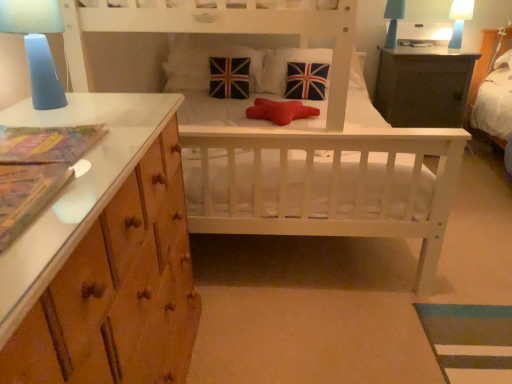
What do you see at coordinates (459, 20) in the screenshot?
I see `blue matte lampshade at upper right, positioned as the 1th bedside lamp in right-to-left order` at bounding box center [459, 20].

Identify the location of blue matte lampshade at upper right, the 2th bedside lamp from the bottom. This screenshot has height=384, width=512. (459, 20).

How much space does union jack fabric pillow at center, which appears as the 4th pillow when viewed from the left, occupy horizontally?

union jack fabric pillow at center, which appears as the 4th pillow when viewed from the left, is 18.10 inches wide.

The image size is (512, 384). What do you see at coordinates (291, 136) in the screenshot?
I see `white wooden crib at center` at bounding box center [291, 136].

This screenshot has width=512, height=384. What do you see at coordinates (229, 77) in the screenshot?
I see `velvet union jack pillow at center, which is the 2th pillow in left-to-right order` at bounding box center [229, 77].

Identify the location of blue frosted glass lamp at upper left, positioned as the first bedside lamp in bottom-to-top order. (37, 46).

Measure the distance between point (404, 11) and camera.

10.58 feet.

Where is `red felt pillow at center, the 2th pillow from the right`? The width and height of the screenshot is (512, 384). red felt pillow at center, the 2th pillow from the right is located at coordinates (280, 111).

This screenshot has height=384, width=512. What are the coordinates of `blue matte lampshade at upper right, which is the 2th bedside lamp in front-to-back order` in the screenshot? It's located at (459, 20).

Is point (461, 21) positioned behind point (23, 22)?

Yes, point (461, 21) is behind point (23, 22).

From a real-world perspective, which object rests below the other?

In real-world perspective, blue matte lampshade at upper right, positioned as the 3th bedside lamp in left-to-right order, is lower.

Considering the relative positions of blue matte lampshade at upper right, which is counted as the 2th bedside lamp, starting from the back, and blue frosted glass lamp at upper left, the third bedside lamp positioned from the top, in the image provided, is blue matte lampshade at upper right, which is counted as the 2th bedside lamp, starting from the back, to the right of blue frosted glass lamp at upper left, the third bedside lamp positioned from the top, from the viewer's perspective?

Correct, you'll find blue matte lampshade at upper right, which is counted as the 2th bedside lamp, starting from the back, to the right of blue frosted glass lamp at upper left, the third bedside lamp positioned from the top.

I want to click on the 2nd bedside lamp counting from the right side of the blue frosted glass lamp at upper left, positioned as the 1th bedside lamp in left-to-right order, so click(459, 20).

Between blue matte lampshade at upper right, the 3th bedside lamp viewed from the front, and dark gray wooden table at upper right, which one has larger size?

dark gray wooden table at upper right.

Based on the photo, how many degrees apart are the facing directions of blue matte lampshade at upper right, marked as the 2th bedside lamp in a right-to-left arrangement, and dark gray wooden table at upper right?

There is a 0.49-degree angle between the facing directions of blue matte lampshade at upper right, marked as the 2th bedside lamp in a right-to-left arrangement, and dark gray wooden table at upper right.

This screenshot has height=384, width=512. I want to click on table that appears in front of the blue matte lampshade at upper right, the 1th bedside lamp in the top-to-bottom sequence, so click(423, 86).

Do you think blue matte lampshade at upper right, the 3th bedside lamp viewed from the front, is within dark gray wooden table at upper right, or outside of it?

blue matte lampshade at upper right, the 3th bedside lamp viewed from the front, is not inside dark gray wooden table at upper right, it's outside.

Is dark gray wooden table at upper right facing away from blue matte lampshade at upper right, which is counted as the 2th bedside lamp, starting from the back?

No, dark gray wooden table at upper right is not facing the opposite direction of blue matte lampshade at upper right, which is counted as the 2th bedside lamp, starting from the back.

Is dark gray wooden table at upper right to the right of blue matte lampshade at upper right, positioned as the 3th bedside lamp in left-to-right order, from the viewer's perspective?

In fact, dark gray wooden table at upper right is to the left of blue matte lampshade at upper right, positioned as the 3th bedside lamp in left-to-right order.

From a real-world perspective, is dark gray wooden table at upper right positioned above or below blue matte lampshade at upper right, positioned as the 3th bedside lamp in left-to-right order?

From a real-world perspective, dark gray wooden table at upper right is physically below blue matte lampshade at upper right, positioned as the 3th bedside lamp in left-to-right order.

From the image's perspective, between dark gray wooden table at upper right and blue matte lampshade at upper right, which is the 2th bedside lamp in front-to-back order, who is located below?

From the image's view, dark gray wooden table at upper right is below.

Does blue matte lampshade at upper right, the 2th bedside lamp from the bottom, come in front of white wooden crib at center?

That is False.

Considering the positions of objects blue matte lampshade at upper right, positioned as the 1th bedside lamp in right-to-left order, and white wooden crib at center in the image provided, who is more to the left, blue matte lampshade at upper right, positioned as the 1th bedside lamp in right-to-left order, or white wooden crib at center?

white wooden crib at center.

Considering the sizes of objects dark gray wooden table at upper right and white wooden crib at center in the image provided, who is bigger, dark gray wooden table at upper right or white wooden crib at center?

white wooden crib at center is bigger.

Looking at their sizes, would you say dark gray wooden table at upper right is wider or thinner than white wooden crib at center?

In the image, dark gray wooden table at upper right appears to be more narrow than white wooden crib at center.

Can you tell me how much dark gray wooden table at upper right and white wooden crib at center differ in facing direction?

The angle between the facing direction of dark gray wooden table at upper right and the facing direction of white wooden crib at center is 1.55 degrees.

Where is `infant bed on the left of dark gray wooden table at upper right`? This screenshot has width=512, height=384. infant bed on the left of dark gray wooden table at upper right is located at coordinates (291, 136).

Who is taller, blue frosted glass lamp at upper left, the third bedside lamp positioned from the top, or velvet union jack pillow at center, which appears as the 1th pillow when viewed from the left?

With more height is velvet union jack pillow at center, which appears as the 1th pillow when viewed from the left.

Is velvet union jack pillow at center, which appears as the 1th pillow when viewed from the left, completely or partially inside blue frosted glass lamp at upper left, positioned as the 1th bedside lamp in left-to-right order?

No, blue frosted glass lamp at upper left, positioned as the 1th bedside lamp in left-to-right order, does not contain velvet union jack pillow at center, which appears as the 1th pillow when viewed from the left.

From a real-world perspective, is blue frosted glass lamp at upper left, positioned as the 1th bedside lamp in left-to-right order, under velvet union jack pillow at center, which appears as the 1th pillow when viewed from the left?

No, from a real-world perspective, blue frosted glass lamp at upper left, positioned as the 1th bedside lamp in left-to-right order, is not below velvet union jack pillow at center, which appears as the 1th pillow when viewed from the left.

Between blue frosted glass lamp at upper left, positioned as the 1th bedside lamp in left-to-right order, and velvet union jack pillow at center, which is counted as the fourth pillow, starting from the right, which one has larger size?

With larger size is velvet union jack pillow at center, which is counted as the fourth pillow, starting from the right.

Considering the positions of points (265, 56) and (451, 37), is point (265, 56) closer to camera compared to point (451, 37)?

Yes.

From the image's perspective, which one is positioned lower, union jack fabric pillow at center, which is the first pillow from right to left, or blue matte lampshade at upper right, the second bedside lamp when ordered from top to bottom?

From the image's view, union jack fabric pillow at center, which is the first pillow from right to left, is below.

Can you confirm if union jack fabric pillow at center, which is the first pillow from right to left, is positioned to the right of blue matte lampshade at upper right, the second bedside lamp when ordered from top to bottom?

Incorrect, union jack fabric pillow at center, which is the first pillow from right to left, is not on the right side of blue matte lampshade at upper right, the second bedside lamp when ordered from top to bottom.

Image resolution: width=512 pixels, height=384 pixels. Find the location of `bedside lamp in front of the blue matte lampshade at upper right, the 2th bedside lamp from the bottom`. bedside lamp in front of the blue matte lampshade at upper right, the 2th bedside lamp from the bottom is located at coordinates (37, 46).

This screenshot has width=512, height=384. I want to click on the 2nd bedside lamp behind the dark gray wooden table at upper right, so click(393, 20).

Considering their positions, is white wooden crib at center positioned further to velvet union jack pillow at center, which is counted as the third pillow, starting from the right, than red felt pillow at center, the 2th pillow from the right?

white wooden crib at center is positioned further to the anchor velvet union jack pillow at center, which is counted as the third pillow, starting from the right.

From the image, which object appears to be farther from red felt pillow at center, the 2th pillow from the right, union jack fabric pillow at center, which appears as the 4th pillow when viewed from the left, or blue matte lampshade at upper right, positioned as the 3th bedside lamp in left-to-right order?

Based on the image, blue matte lampshade at upper right, positioned as the 3th bedside lamp in left-to-right order, appears to be further to red felt pillow at center, the 2th pillow from the right.

When comparing their distances from union jack fabric pillow at center, which is the first pillow from right to left, does red felt pillow at center, the 2th pillow from the right, or velvet union jack pillow at center, which is counted as the third pillow, starting from the right, seem further?

Based on the image, red felt pillow at center, the 2th pillow from the right, appears to be further to union jack fabric pillow at center, which is the first pillow from right to left.

Considering their positions, is dark gray wooden table at upper right positioned further to white wooden crib at center than velvet union jack pillow at center, which is counted as the fourth pillow, starting from the right?

dark gray wooden table at upper right lies further to white wooden crib at center than the other object.

Considering their positions, is dark gray wooden table at upper right positioned closer to red felt pillow at center, the 2th pillow from the right, than blue matte lampshade at upper right, positioned as the 1th bedside lamp in right-to-left order?

dark gray wooden table at upper right.

Considering their positions, is velvet union jack pillow at center, which is the 2th pillow in left-to-right order, positioned further to velvet union jack pillow at center, which appears as the 1th pillow when viewed from the left, than blue matte lampshade at upper right, positioned as the 3th bedside lamp in left-to-right order?

blue matte lampshade at upper right, positioned as the 3th bedside lamp in left-to-right order, lies further to velvet union jack pillow at center, which appears as the 1th pillow when viewed from the left, than the other object.

Considering their positions, is red felt pillow at center, the 3th pillow viewed from the left, positioned closer to velvet union jack pillow at center, which is counted as the fourth pillow, starting from the right, than union jack fabric pillow at center, which is the first pillow from right to left?

Based on the image, union jack fabric pillow at center, which is the first pillow from right to left, appears to be nearer to velvet union jack pillow at center, which is counted as the fourth pillow, starting from the right.

Estimate the real-world distances between objects in this image. Which object is closer to blue frosted glass lamp at upper left, which ranks as the 1th bedside lamp in front-to-back order, dark gray wooden table at upper right or white wooden crib at center?

Among the two, white wooden crib at center is located nearer to blue frosted glass lamp at upper left, which ranks as the 1th bedside lamp in front-to-back order.

This screenshot has width=512, height=384. I want to click on bedside lamp between velvet union jack pillow at center, which is counted as the third pillow, starting from the right, and dark gray wooden table at upper right, so click(x=393, y=20).

The width and height of the screenshot is (512, 384). Find the location of `infant bed located between blue frosted glass lamp at upper left, the third bedside lamp positioned from the top, and blue matte lampshade at upper right, the 1th bedside lamp in the top-to-bottom sequence, in the depth direction`. infant bed located between blue frosted glass lamp at upper left, the third bedside lamp positioned from the top, and blue matte lampshade at upper right, the 1th bedside lamp in the top-to-bottom sequence, in the depth direction is located at coordinates (291, 136).

At what (x,y) coordinates should I click in order to perform the action: click on bedside lamp between union jack fabric pillow at center, which is the first pillow from right to left, and dark gray wooden table at upper right, in the horizontal direction. Please return your answer as a coordinate pair (x, y). The image size is (512, 384). Looking at the image, I should click on (393, 20).

At what (x,y) coordinates should I click in order to perform the action: click on pillow located between blue frosted glass lamp at upper left, which ranks as the 1th bedside lamp in front-to-back order, and velvet union jack pillow at center, which is counted as the third pillow, starting from the right, in the depth direction. Please return your answer as a coordinate pair (x, y). This screenshot has height=384, width=512. Looking at the image, I should click on (x=280, y=111).